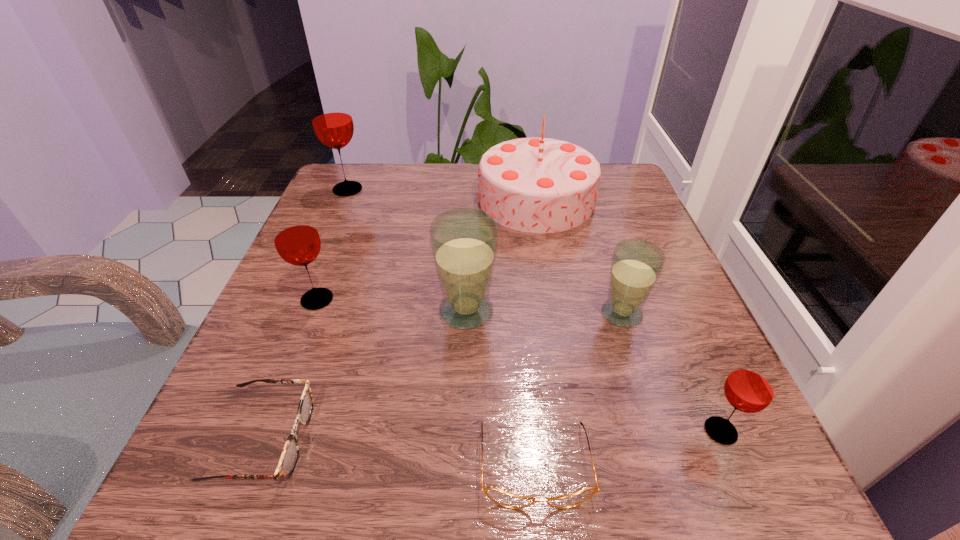
Where is `the farthest red glass`? the farthest red glass is located at coordinates (331, 117).

Identify the location of the farthest glass. (331, 117).

You are a GUI agent. You are given a task and a screenshot of the screen. Output one action in this format:
    pyautogui.click(x=<x>, y=<y>)
    Task: Click on the birthday cake
    This screenshot has width=960, height=540.
    Given the screenshot: What is the action you would take?
    pyautogui.click(x=541, y=185)

Locate an element on the screen. This screenshot has width=960, height=540. the second smallest red glass is located at coordinates (297, 241).

Find the location of a particular element. the left blue glass is located at coordinates (464, 242).

Image resolution: width=960 pixels, height=540 pixels. I want to click on the third glass from right to left, so click(464, 242).

Where is `the fourth glass from left to right`? The height and width of the screenshot is (540, 960). the fourth glass from left to right is located at coordinates (636, 264).

Identify the location of the right blue glass. click(636, 264).

At what (x,y) coordinates should I click in order to perform the action: click on the smallest red glass. Please return your answer as a coordinate pair (x, y). The width and height of the screenshot is (960, 540). Looking at the image, I should click on (751, 386).

Locate an element on the screen. the rightmost red glass is located at coordinates (751, 386).